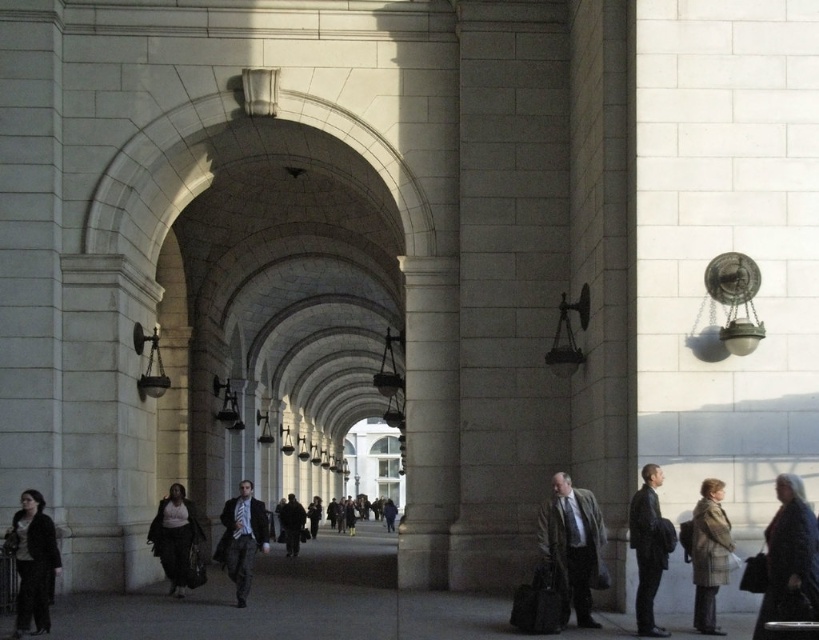
You are a fashion designer observing two suits displayed in an archway. The dark gray suit at right and the matte black suit at center. Which suit has a narrower silhouette?

The dark gray suit at right has a narrower silhouette than the matte black suit at center because it is thinner.

You are standing in the archway and see both the gray wool coat at center and the dark gray suit at center. Which one is more to the right?

The gray wool coat at center is positioned on the right side of dark gray suit at center, so it is more to the right.

You are an interior designer arranging a display in the archway. You have a gray wool coat at center and a matte black suit at center. Which item should you place on the lower shelf to ensure proper visibility of both items?

The gray wool coat at center has a lesser height compared to the matte black suit at center, so placing the gray wool coat at center on the lower shelf will ensure both items are visible.